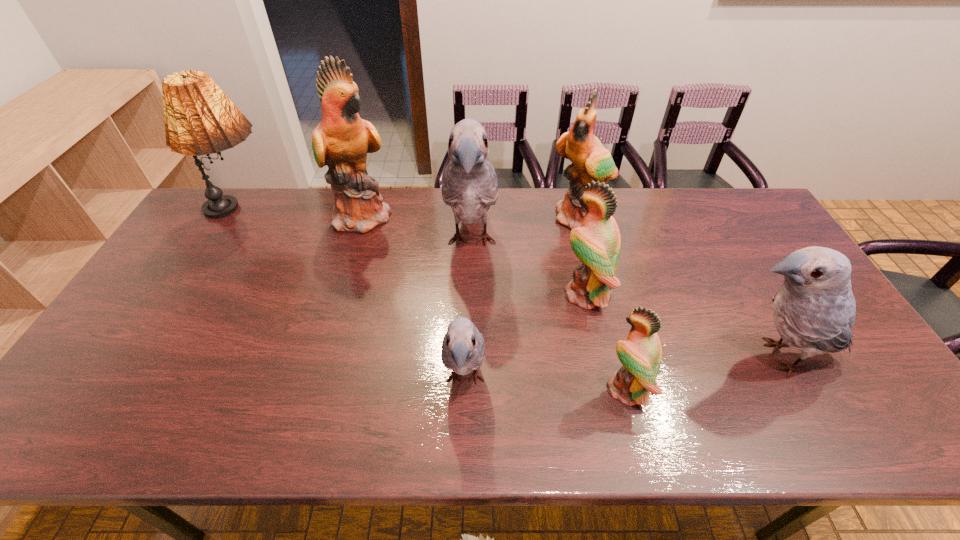
I want to click on the tallest parrot, so click(x=342, y=139).

Where is `the biggest green parrot`? the biggest green parrot is located at coordinates (342, 139).

Locate an element on the screen. The width and height of the screenshot is (960, 540). lampshade is located at coordinates (200, 119).

This screenshot has width=960, height=540. What are the coordinates of `the third smallest green parrot` in the screenshot? It's located at [590, 160].

The width and height of the screenshot is (960, 540). I want to click on the biggest gray parrot, so click(x=470, y=186).

I want to click on the third biggest green parrot, so click(597, 243).

Locate an element on the screen. This screenshot has width=960, height=540. the rightmost object is located at coordinates (814, 310).

Locate an element on the screen. the rightmost parrot is located at coordinates (814, 310).

At what (x,y) coordinates should I click in order to perform the action: click on the smallest green parrot. Please return your answer as a coordinate pair (x, y). This screenshot has height=540, width=960. Looking at the image, I should click on (640, 354).

Where is `the smallest gray parrot`? This screenshot has height=540, width=960. the smallest gray parrot is located at coordinates (463, 349).